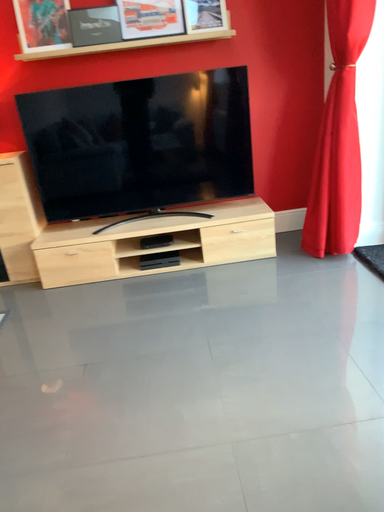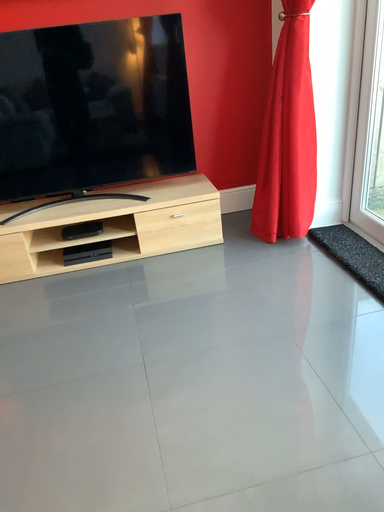
Question: How did the camera likely rotate when shooting the video?

Choices:
 (A) rotated left
 (B) rotated right

Answer: (B)